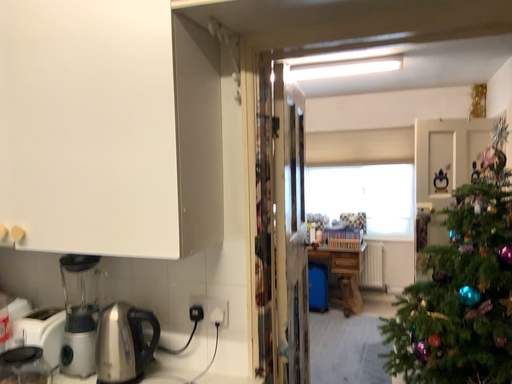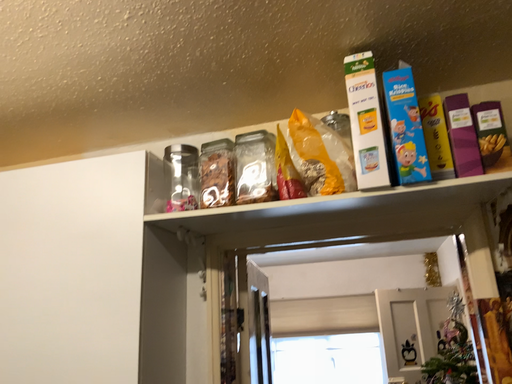
Question: How did the camera likely rotate when shooting the video?

Choices:
 (A) rotated upward
 (B) rotated downward

Answer: (A)